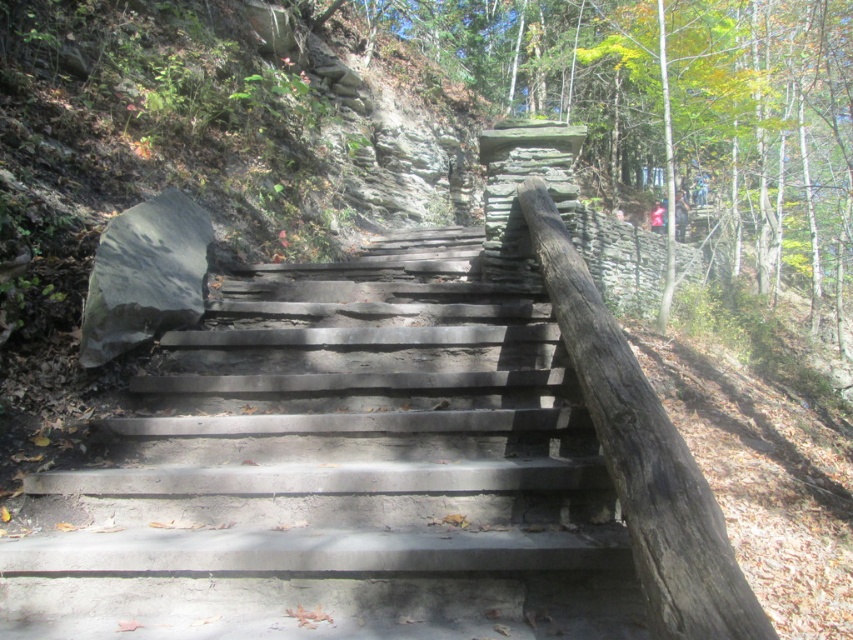
Can you confirm if gray concrete stairs at center is positioned above smooth brown log at right?

No, gray concrete stairs at center is not above smooth brown log at right.

Is gray concrete stairs at center below smooth brown log at right?

Indeed, gray concrete stairs at center is positioned under smooth brown log at right.

Who is more forward, (x=172, y=566) or (x=662, y=595)?

Point (x=662, y=595) is more forward.

Identify the location of gray concrete stairs at center. point(339,472).